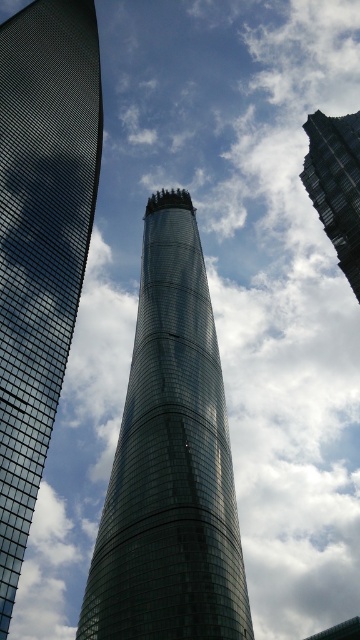
Question: Is shiny glass tower at center bigger than shiny glass skyscraper at left?

Choices:
 (A) yes
 (B) no

Answer: (B)

Question: Which object is closer to the camera taking this photo?

Choices:
 (A) shiny glass tower at center
 (B) glassy skyscraper at upper right
 (C) shiny glass skyscraper at left

Answer: (C)

Question: Is shiny glass skyscraper at left to the left of glassy skyscraper at upper right from the viewer's perspective?

Choices:
 (A) no
 (B) yes

Answer: (B)

Question: Which of the following is the closest to the observer?

Choices:
 (A) shiny glass skyscraper at left
 (B) glassy skyscraper at upper right

Answer: (A)

Question: Is shiny glass tower at center behind shiny glass skyscraper at left?

Choices:
 (A) yes
 (B) no

Answer: (A)

Question: Which is farther from the glassy skyscraper at upper right?

Choices:
 (A) shiny glass skyscraper at left
 (B) shiny glass tower at center

Answer: (A)